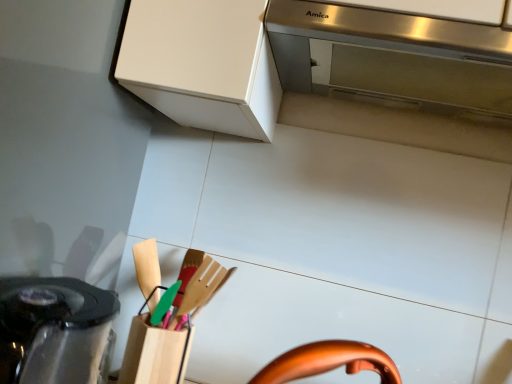
Question: Does stainless steel range hood at upper center come in front of black glossy kettle at lower left?

Choices:
 (A) no
 (B) yes

Answer: (A)

Question: Is stainless steel range hood at upper center turned away from black glossy kettle at lower left?

Choices:
 (A) no
 (B) yes

Answer: (A)

Question: From the image's perspective, is stainless steel range hood at upper center located above black glossy kettle at lower left?

Choices:
 (A) no
 (B) yes

Answer: (B)

Question: Does stainless steel range hood at upper center lie behind black glossy kettle at lower left?

Choices:
 (A) yes
 (B) no

Answer: (A)

Question: Does stainless steel range hood at upper center contain black glossy kettle at lower left?

Choices:
 (A) no
 (B) yes

Answer: (A)

Question: Considering the relative positions of stainless steel range hood at upper center and black glossy kettle at lower left in the image provided, is stainless steel range hood at upper center to the right of black glossy kettle at lower left from the viewer's perspective?

Choices:
 (A) no
 (B) yes

Answer: (B)

Question: Considering the relative sizes of black glossy kettle at lower left and stainless steel range hood at upper center in the image provided, is black glossy kettle at lower left bigger than stainless steel range hood at upper center?

Choices:
 (A) yes
 (B) no

Answer: (A)

Question: Is black glossy kettle at lower left further to the viewer compared to stainless steel range hood at upper center?

Choices:
 (A) yes
 (B) no

Answer: (B)

Question: Is black glossy kettle at lower left wider than stainless steel range hood at upper center?

Choices:
 (A) yes
 (B) no

Answer: (B)

Question: From a real-world perspective, is black glossy kettle at lower left over stainless steel range hood at upper center?

Choices:
 (A) yes
 (B) no

Answer: (B)

Question: Could you tell me if black glossy kettle at lower left is turned towards stainless steel range hood at upper center?

Choices:
 (A) no
 (B) yes

Answer: (A)

Question: Does black glossy kettle at lower left appear on the left side of stainless steel range hood at upper center?

Choices:
 (A) no
 (B) yes

Answer: (B)

Question: From a real-world perspective, is stainless steel range hood at upper center above or below black glossy kettle at lower left?

Choices:
 (A) above
 (B) below

Answer: (A)